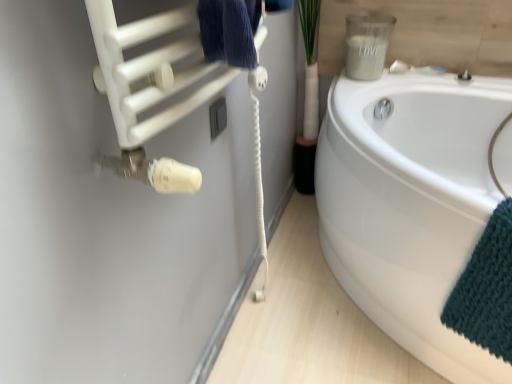
Question: From the image's perspective, is white glossy bathtub at lower right above teal knitted towel at lower right?

Choices:
 (A) yes
 (B) no

Answer: (A)

Question: From a real-world perspective, is white glossy bathtub at lower right on teal knitted towel at lower right?

Choices:
 (A) no
 (B) yes

Answer: (A)

Question: Is white glossy bathtub at lower right wider than teal knitted towel at lower right?

Choices:
 (A) yes
 (B) no

Answer: (A)

Question: Is white glossy bathtub at lower right thinner than teal knitted towel at lower right?

Choices:
 (A) yes
 (B) no

Answer: (B)

Question: Is white glossy bathtub at lower right shorter than teal knitted towel at lower right?

Choices:
 (A) yes
 (B) no

Answer: (B)

Question: Is white glossy bathtub at lower right to the left of teal knitted towel at lower right from the viewer's perspective?

Choices:
 (A) yes
 (B) no

Answer: (A)

Question: Is white matte towel at upper left bigger than teal knitted towel at lower right?

Choices:
 (A) no
 (B) yes

Answer: (B)

Question: Does white matte towel at upper left have a greater width compared to teal knitted towel at lower right?

Choices:
 (A) no
 (B) yes

Answer: (A)

Question: Is white matte towel at upper left aimed at teal knitted towel at lower right?

Choices:
 (A) no
 (B) yes

Answer: (B)

Question: Is white matte towel at upper left smaller than teal knitted towel at lower right?

Choices:
 (A) yes
 (B) no

Answer: (B)

Question: Can teal knitted towel at lower right be found inside white matte towel at upper left?

Choices:
 (A) no
 (B) yes

Answer: (A)

Question: From a real-world perspective, is white matte towel at upper left under teal knitted towel at lower right?

Choices:
 (A) no
 (B) yes

Answer: (A)

Question: From the image's perspective, is satin nickel faucet at upper right on top of white matte towel at upper left?

Choices:
 (A) yes
 (B) no

Answer: (A)